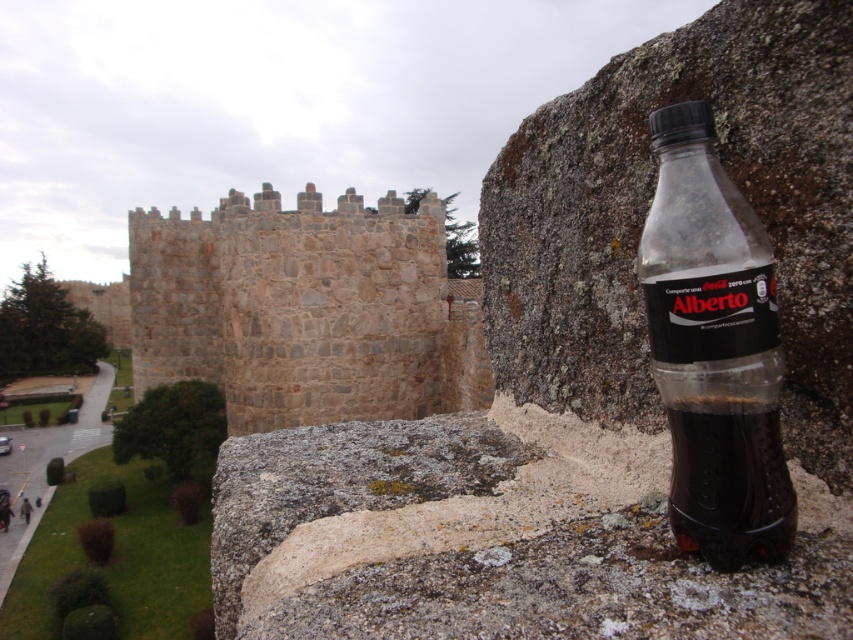
You are standing in front of the medieval stone wall and the modern plastic bottle. There are two points marked in the scene. Which point is closer to you, point at coordinates (473, 381) or point at coordinates (668, 122)?

Point at coordinates (473, 381) is closer to you than point at coordinates (668, 122) because it is further to the viewer.

You are an archaeologist examining the scene. You need to determine which object takes up more space in the image. Which one is larger in size between the stone wall at center and the translucent plastic bottle at right?

The stone wall at center has a larger size compared to the translucent plastic bottle at right, so the stone wall at center is larger.